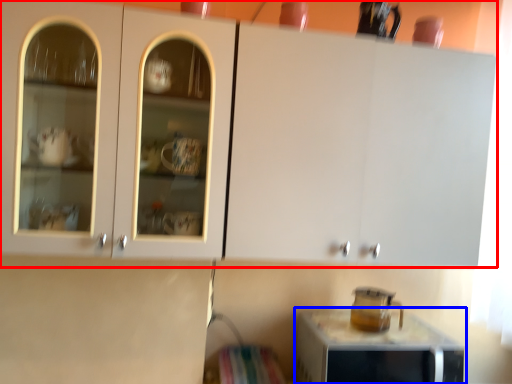
Question: Which object appears farthest to the camera in this image, cabinetry (highlighted by a red box) or home appliance (highlighted by a blue box)?

Choices:
 (A) cabinetry
 (B) home appliance

Answer: (B)